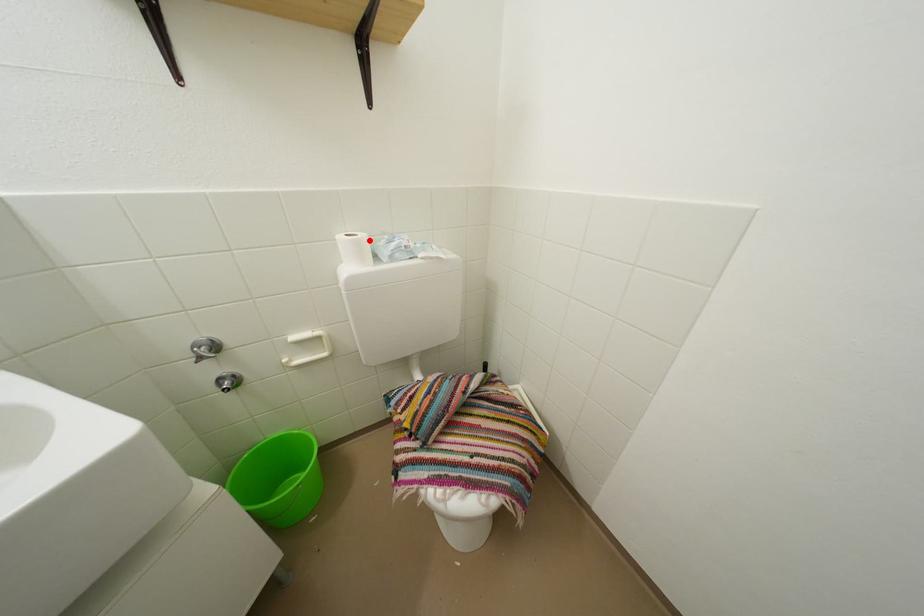
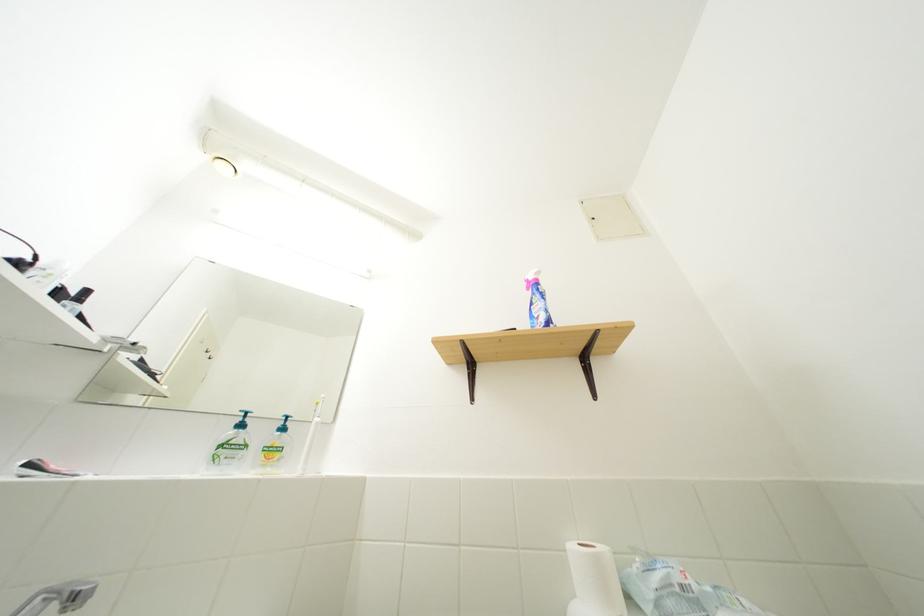
In the second image, find the point that corresponds to the highlighted location in the first image.

(609, 554)